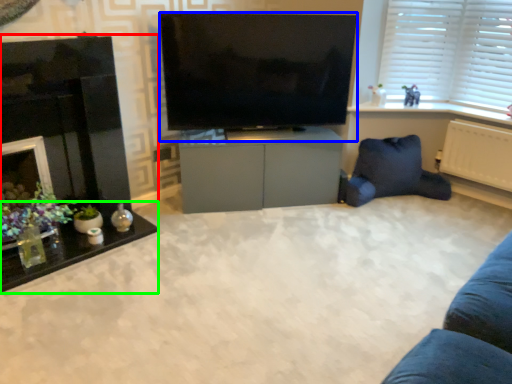
Question: Which object is positioned closest to fireplace (highlighted by a red box)? Select from television (highlighted by a blue box) and table (highlighted by a green box).

Choices:
 (A) television
 (B) table

Answer: (B)